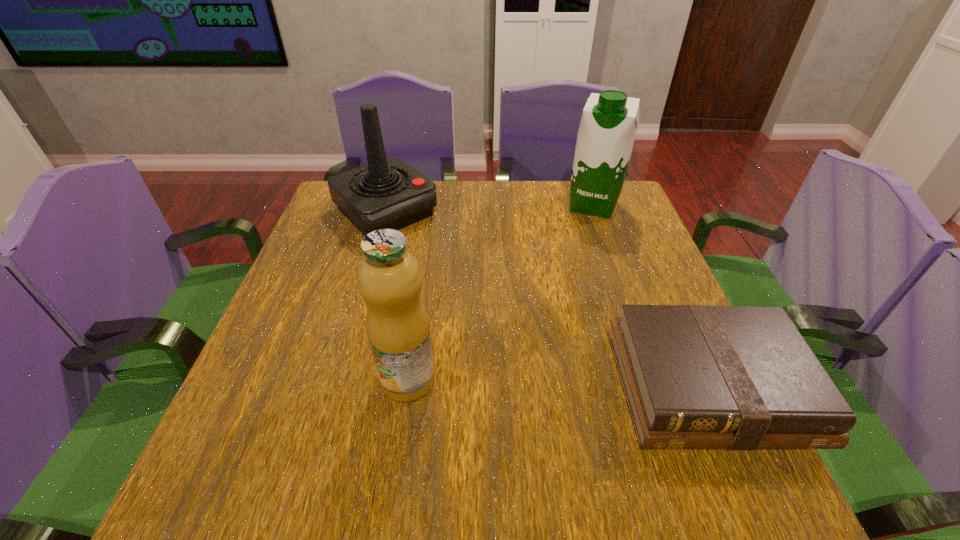
Find the location of `vacant space on the desktop that is between the fruit juice and the shortest object and is positioned on the front-facing side of the soya milk`. vacant space on the desktop that is between the fruit juice and the shortest object and is positioned on the front-facing side of the soya milk is located at coordinates (539, 382).

Identify the location of vacant space on the desktop that is between the fruit juice and the shortest object and is positioned on the front-facing side of the joystick. (581, 383).